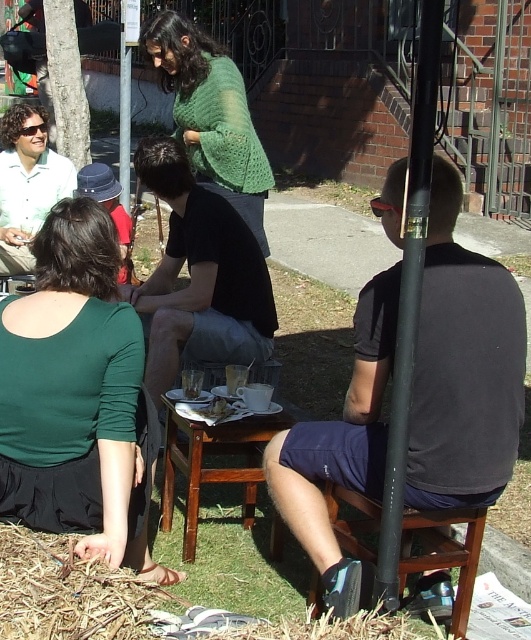
Can you confirm if green matte shirt at lower left is taller than woodenobject at center?

Yes.

Does point (71, 339) come farther from viewer compared to point (199, 429)?

That is False.

Locate an element on the screen. green matte shirt at lower left is located at coordinates (78, 385).

Who is positioned more to the left, black matte pole at right or wooden stool at lower right?

Positioned to the left is black matte pole at right.

What do you see at coordinates (409, 292) in the screenshot?
I see `black matte pole at right` at bounding box center [409, 292].

Is point (393, 596) positioned in front of point (438, 531)?

Yes, point (393, 596) is in front of point (438, 531).

The height and width of the screenshot is (640, 531). I want to click on black matte pole at right, so click(409, 292).

Measure the distance between point [244,177] and camera.

They are 4.43 meters apart.

Identify the location of green knitted sweater at center. This screenshot has height=640, width=531. 211,115.